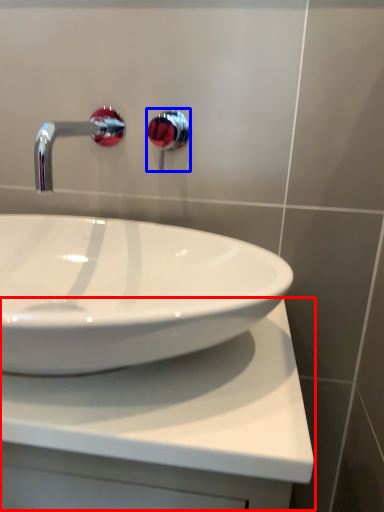
Question: Which of the following is the closest to the observer, counter top (highlighted by a red box) or plumbing fixture (highlighted by a blue box)?

Choices:
 (A) counter top
 (B) plumbing fixture

Answer: (A)